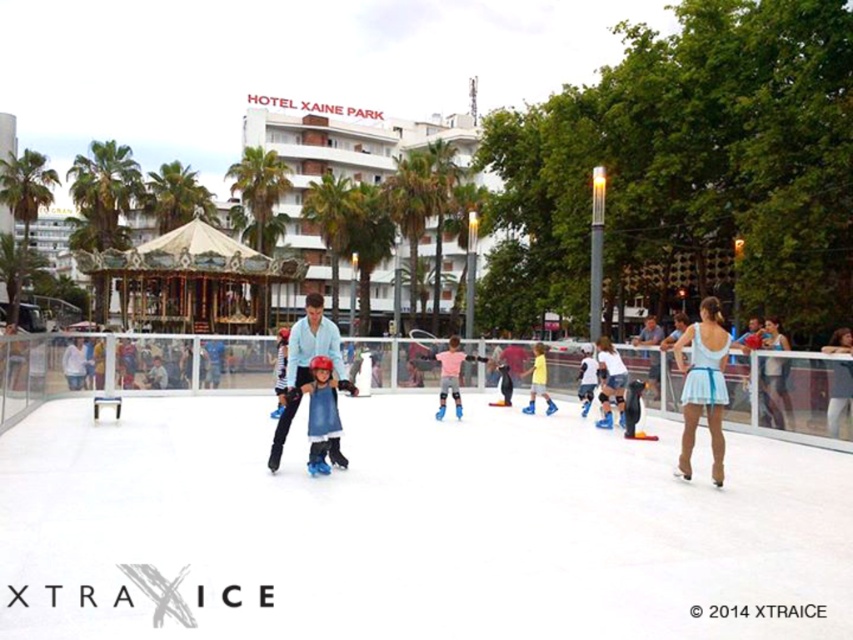
You are a photographer standing at the edge of the ice rink. You want to take a photo of the yellow matte skates at center and the blue fabric dress at center. Which object should you focus on first if you want to capture both in a single frame without moving the camera?

The yellow matte skates at center is positioned under the blue fabric dress at center, so you should focus on the blue fabric dress at center first to ensure both are in the frame.

You are standing at the entrance of the ice skating rink and want to reach the white smooth ice at center. According to the coordinates provided, in which direction should you move relative to your current position?

The white smooth ice at center is located at coordinates point (410, 529), so you should move forward and to the right to reach it.

You are an event planner organizing a skating event and need to ensure that participants can move freely between the light blue fabric dress at center and the yellow matte skates at center. Based on their sizes, is there enough space for people to pass through comfortably?

The light blue fabric dress at center might be wider than yellow matte skates at center, so there may not be enough space for people to pass through comfortably between them. Consider adjusting their positions to allow more room.